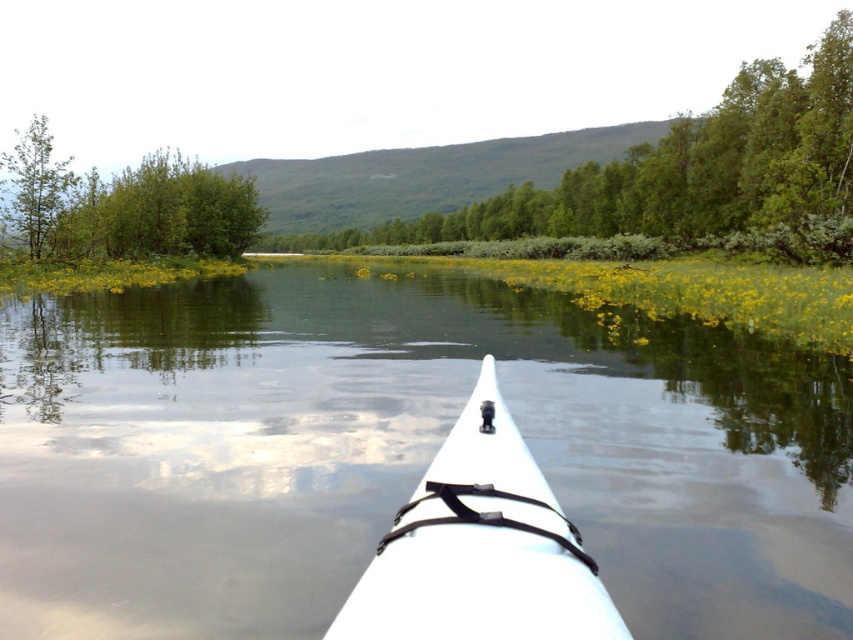
Question: Is white matte kayak at center wider than green leafy tree at upper left?

Choices:
 (A) no
 (B) yes

Answer: (A)

Question: Which object appears farthest from the camera in this image?

Choices:
 (A) clear water at center
 (B) green leafy tree at left
 (C) green leafy trees at upper center

Answer: (B)

Question: Does green leafy trees at upper center have a larger size compared to white matte kayak at center?

Choices:
 (A) yes
 (B) no

Answer: (A)

Question: Which of the following is the closest to the observer?

Choices:
 (A) (9, 179)
 (B) (141, 397)

Answer: (B)

Question: Among these objects, which one is nearest to the camera?

Choices:
 (A) clear water at center
 (B) green leafy tree at left
 (C) green leafy tree at upper left

Answer: (A)

Question: Can you confirm if white matte kayak at center is positioned to the left of green leafy tree at left?

Choices:
 (A) yes
 (B) no

Answer: (B)